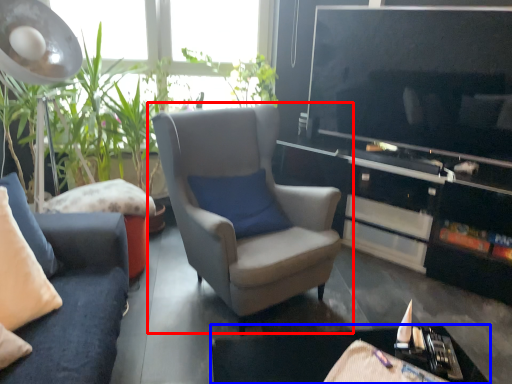
Question: Which object appears farthest to the camera in this image, chair (highlighted by a red box) or table (highlighted by a blue box)?

Choices:
 (A) chair
 (B) table

Answer: (A)